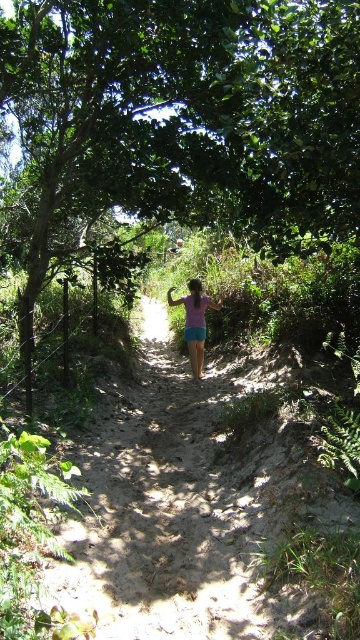
Question: Which point is farther to the camera?

Choices:
 (A) (190, 339)
 (B) (218, 164)
 (C) (198, 333)

Answer: (A)

Question: Which point is farther to the camera?

Choices:
 (A) (186, 339)
 (B) (186, 326)

Answer: (A)

Question: Is green leafy tree at center positioned at the back of pink fabric shorts at center?

Choices:
 (A) no
 (B) yes

Answer: (A)

Question: Does green leafy tree at center have a larger size compared to purple cotton shorts at center?

Choices:
 (A) yes
 (B) no

Answer: (A)

Question: Which object appears farthest from the camera in this image?

Choices:
 (A) pink fabric shorts at center
 (B) purple cotton shorts at center

Answer: (A)

Question: Is green leafy tree at center bigger than pink fabric shorts at center?

Choices:
 (A) yes
 (B) no

Answer: (A)